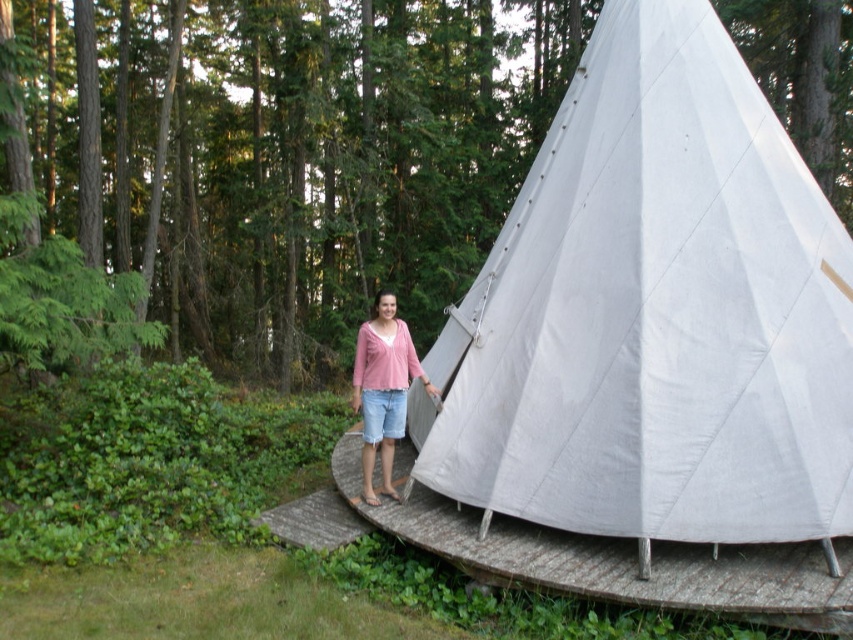
You are a hiker who has just arrived at a campsite in the forest. You see the white canvas tent at center. Based on its position coordinates, can you determine if the tent is placed closer to the edge of the campsite or near the center?

The white canvas tent at center is located at coordinates point (654, 314). Since the coordinates are close to 0.5 in both axes, the tent is positioned near the center of the campsite.

You are a hiker carrying a backpack and need to enter the white canvas tent at center. There is a white fabric ramp at lower center nearby. Which object should you approach first to enter the tent?

You should approach the white fabric ramp at lower center first since it is closer to you than the white canvas tent at center, which is further away.

You are setting up a temporary ramp for accessibility at a campsite. You have a white fabric ramp at lower center and a matte pink sweater at center. Which object is positioned to the right of the other?

The white fabric ramp at lower center is positioned to the right of the matte pink sweater at center.